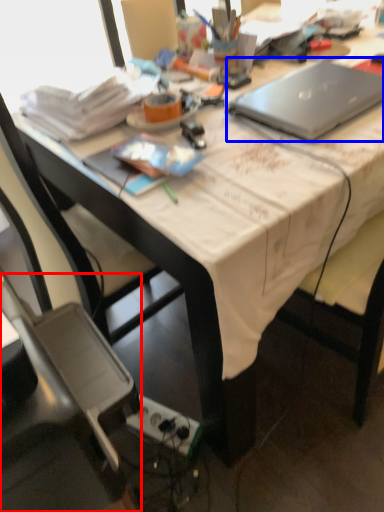
Question: Which object appears farthest to the camera in this image, chair (highlighted by a red box) or laptop (highlighted by a blue box)?

Choices:
 (A) chair
 (B) laptop

Answer: (B)